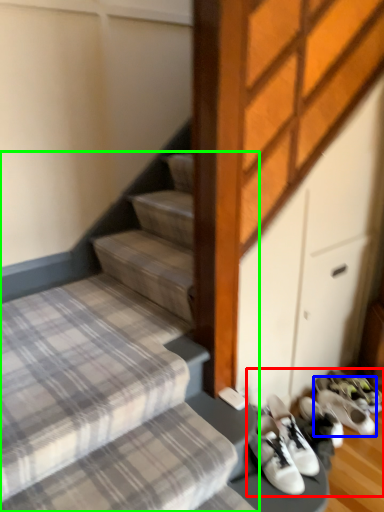
Question: Which is farther away from footwear (highlighted by a red box)? footwear (highlighted by a blue box) or stairs (highlighted by a green box)?

Choices:
 (A) footwear
 (B) stairs

Answer: (B)